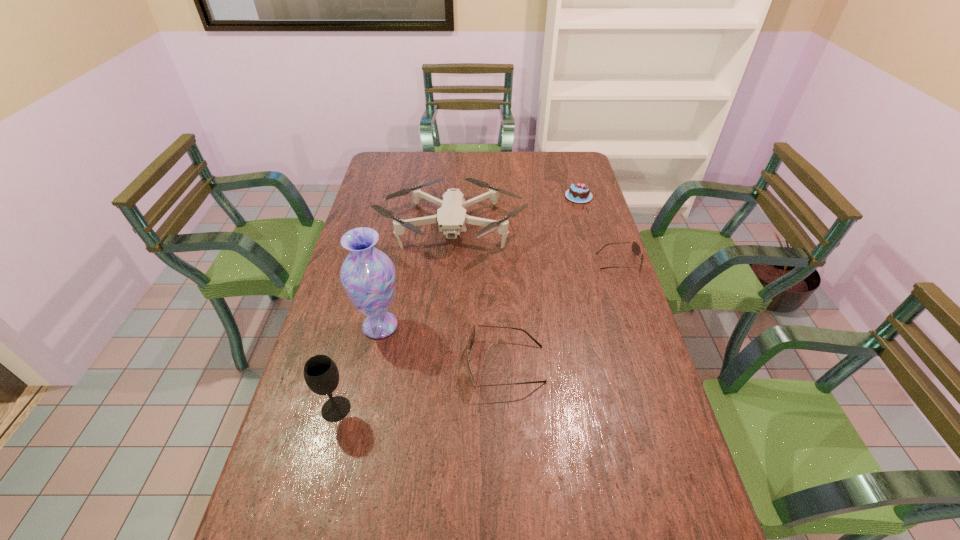
Where is `the taller sunglasses`? the taller sunglasses is located at coordinates 471,338.

The width and height of the screenshot is (960, 540). What are the coordinates of `the nearer sunglasses` in the screenshot? It's located at (471, 338).

This screenshot has height=540, width=960. I want to click on the right sunglasses, so click(x=636, y=249).

Where is `the shorter sunglasses`? the shorter sunglasses is located at coordinates (636, 249).

You are a GUI agent. You are given a task and a screenshot of the screen. Output one action in this format:
    pyautogui.click(x=<x>, y=<y>)
    Task: Click on the third tallest object
    The height and width of the screenshot is (540, 960).
    Given the screenshot: What is the action you would take?
    pyautogui.click(x=451, y=217)

Where is `the fifth tallest object`? This screenshot has width=960, height=540. the fifth tallest object is located at coordinates (578, 192).

Where is `vase`? This screenshot has height=540, width=960. vase is located at coordinates (368, 276).

Identify the location of the second tallest object. [321, 374].

The width and height of the screenshot is (960, 540). Identify the location of vacant region located 0.180m on the front-facing side of the third shortest object. (401, 364).

I want to click on vacant space located 0.210m on the front-facing side of the third shortest object, so click(390, 364).